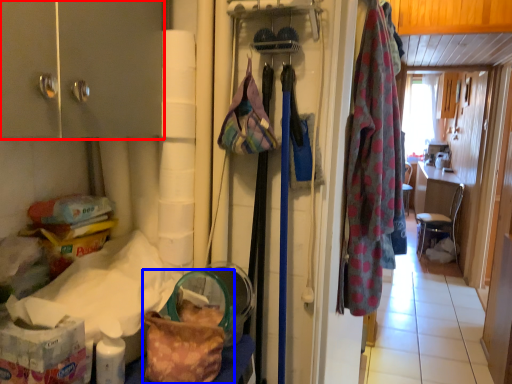
Question: Which object appears farthest to the camera in this image, cabinetry (highlighted by a red box) or handbag (highlighted by a blue box)?

Choices:
 (A) cabinetry
 (B) handbag

Answer: (B)